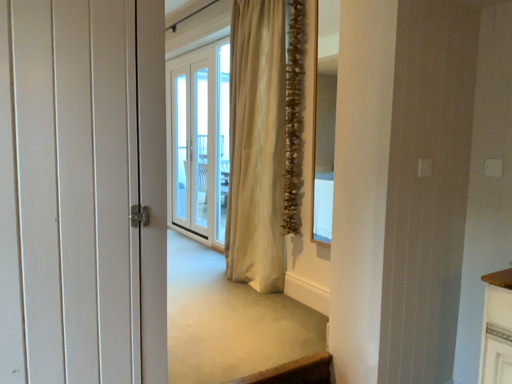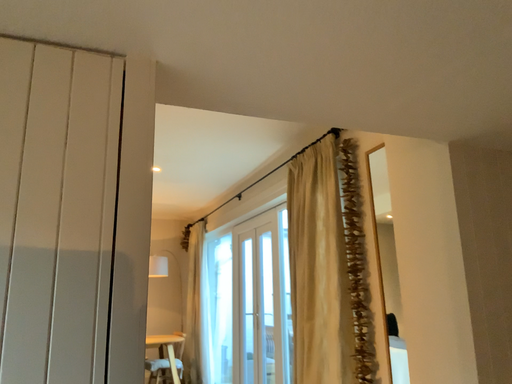
Question: How did the camera likely rotate when shooting the video?

Choices:
 (A) rotated downward
 (B) rotated upward

Answer: (B)